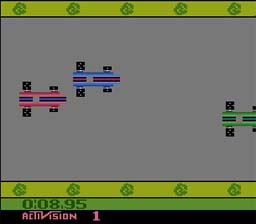
The image size is (256, 224). I want to click on timer or clock, so click(x=59, y=204).